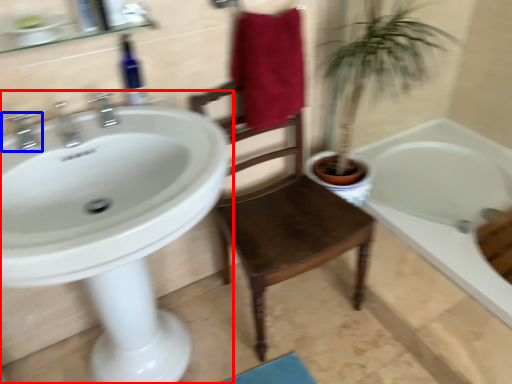
Question: Which object appears farthest to the camera in this image, sink (highlighted by a red box) or tap (highlighted by a blue box)?

Choices:
 (A) sink
 (B) tap

Answer: (B)